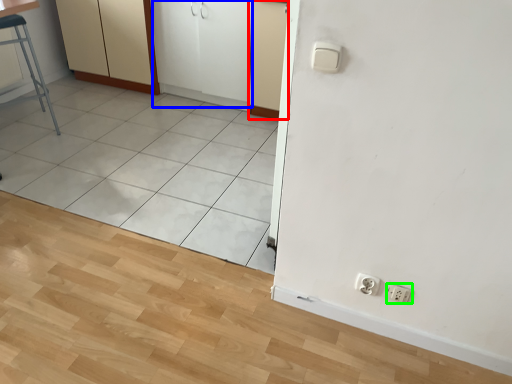
Question: Considering the real-world distances, which object is closest to screen door (highlighted by a red box)? screen door (highlighted by a blue box) or socket (highlighted by a green box).

Choices:
 (A) screen door
 (B) socket

Answer: (A)